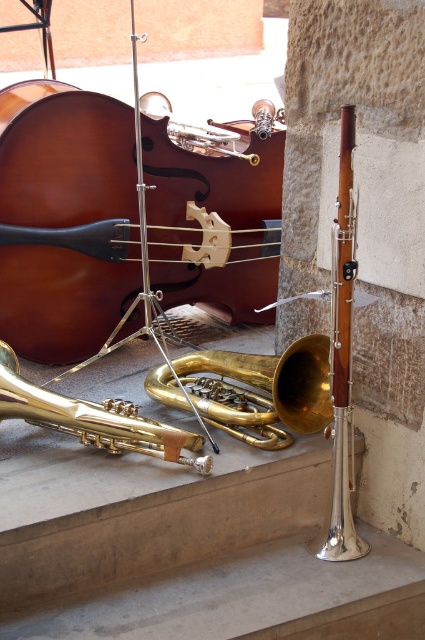
Between matte brown cello at center and gold brass trumpet at center, which one has more height?

gold brass trumpet at center is taller.

Which is more to the left, matte brown cello at center or gold brass trumpet at center?

Positioned to the left is matte brown cello at center.

Is point (11, 285) closer to camera compared to point (342, 417)?

No, (11, 285) is further to viewer.

The width and height of the screenshot is (425, 640). In order to click on matte brown cello at center in this screenshot , I will do tap(65, 220).

Which is above, matte brown cello at center or gold shiny trumpet at lower left?

matte brown cello at center is above.

Does matte brown cello at center have a greater width compared to gold shiny trumpet at lower left?

Correct, the width of matte brown cello at center exceeds that of gold shiny trumpet at lower left.

Who is more forward, (113, 138) or (108, 413)?

Point (108, 413)

This screenshot has height=640, width=425. I want to click on matte brown cello at center, so click(65, 220).

Can you confirm if matte brown cello at center is smaller than gold shiny trumpet at center?

Actually, matte brown cello at center might be larger than gold shiny trumpet at center.

Does matte brown cello at center have a lesser width compared to gold shiny trumpet at center?

No, matte brown cello at center is not thinner than gold shiny trumpet at center.

Is point (105, 156) positioned before point (246, 412)?

No, (105, 156) is behind (246, 412).

What are the coordinates of `matte brown cello at center` in the screenshot? It's located at (65, 220).